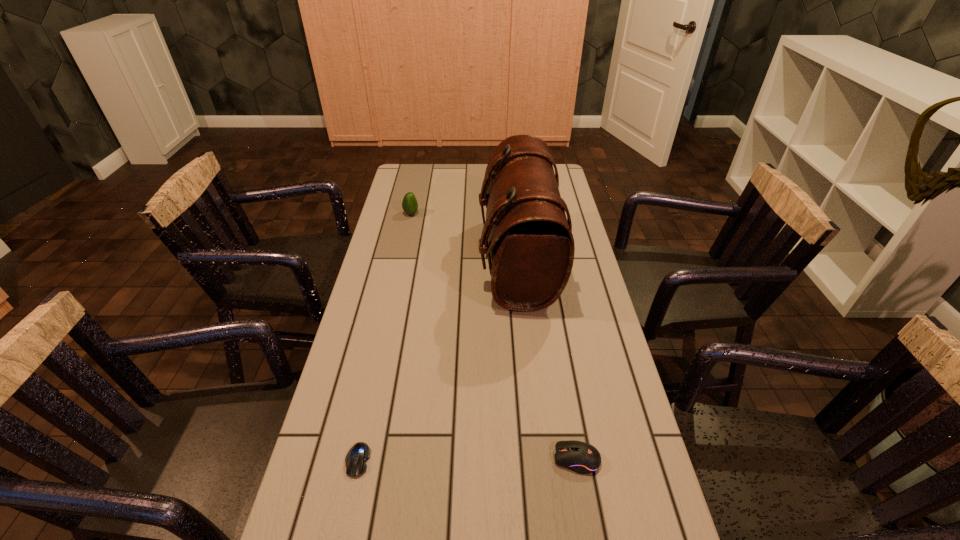
At what (x,y) coordinates should I click in order to perform the action: click on vacant space located on the front-facing side of the satchel. Please return your answer as a coordinate pair (x, y). Looking at the image, I should click on (402, 261).

Identify the location of free region located on the front of the avocado. (405, 243).

You are a GUI agent. You are given a task and a screenshot of the screen. Output one action in this format:
    pyautogui.click(x=<x>, y=<y>)
    Task: Click on the blank area located on the back of the right computer mouse
    Image resolution: width=960 pixels, height=540 pixels.
    Given the screenshot: What is the action you would take?
    pyautogui.click(x=557, y=342)

In order to click on free space located on the button side of the shortest object in this screenshot , I will do `click(348, 503)`.

This screenshot has height=540, width=960. I want to click on avocado located at the left edge, so click(409, 204).

I want to click on computer mouse located in the left edge section of the desktop, so click(356, 458).

You are a GUI agent. You are given a task and a screenshot of the screen. Output one action in this format:
    pyautogui.click(x=<x>, y=<y>)
    Task: Click on the satchel situated at the right edge
    This screenshot has width=960, height=540.
    Given the screenshot: What is the action you would take?
    pyautogui.click(x=531, y=244)

The image size is (960, 540). I want to click on computer mouse located in the right edge section of the desktop, so click(581, 457).

In the image, there is a desktop. Where is `free space at the far edge`? free space at the far edge is located at coordinates tap(456, 186).

In the image, there is a desktop. Identify the location of vacant space at the left edge. (388, 214).